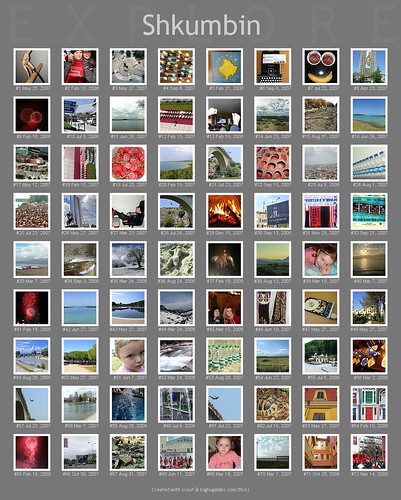
Where is `pictures in bottom row`? The image size is (401, 500). pictures in bottom row is located at coordinates (38, 458), (82, 458), (133, 458), (180, 461), (226, 458), (274, 458), (317, 452), (372, 456).